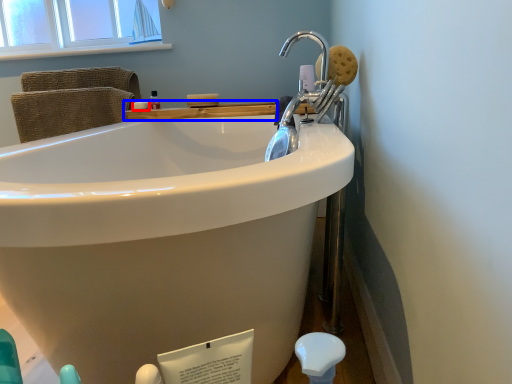
Question: Which object is further to the camera taking this photo, soap (highlighted by a red box) or counter top (highlighted by a blue box)?

Choices:
 (A) soap
 (B) counter top

Answer: (A)